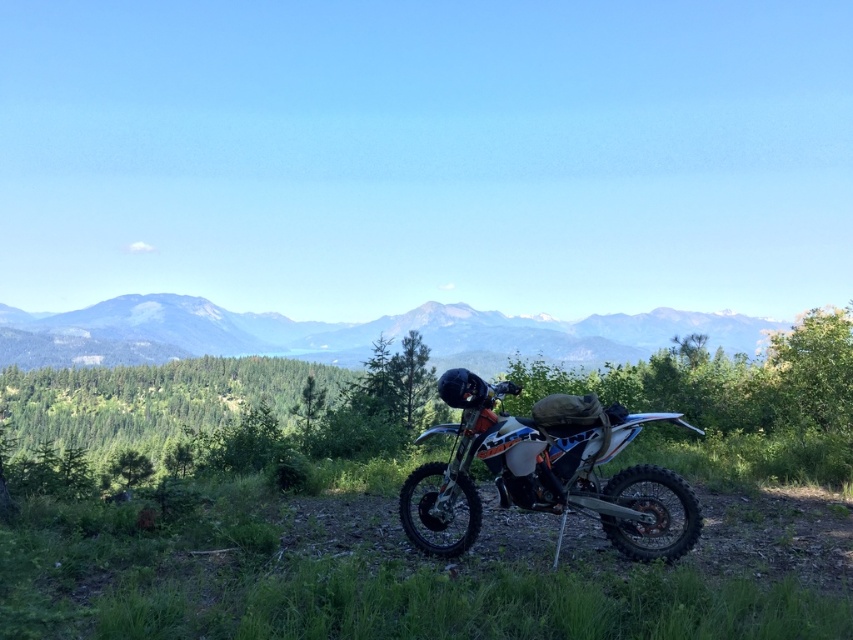
Question: Does green forested mountain at center appear on the right side of matte black motorcycle at center?

Choices:
 (A) no
 (B) yes

Answer: (A)

Question: Considering the relative positions of green forested mountain at center and matte black motorcycle at center in the image provided, where is green forested mountain at center located with respect to matte black motorcycle at center?

Choices:
 (A) right
 (B) left

Answer: (B)

Question: Which point is farther to the camera?

Choices:
 (A) (718, 314)
 (B) (496, 429)

Answer: (A)

Question: Is green forested mountain at center positioned before matte black motorcycle at center?

Choices:
 (A) no
 (B) yes

Answer: (A)